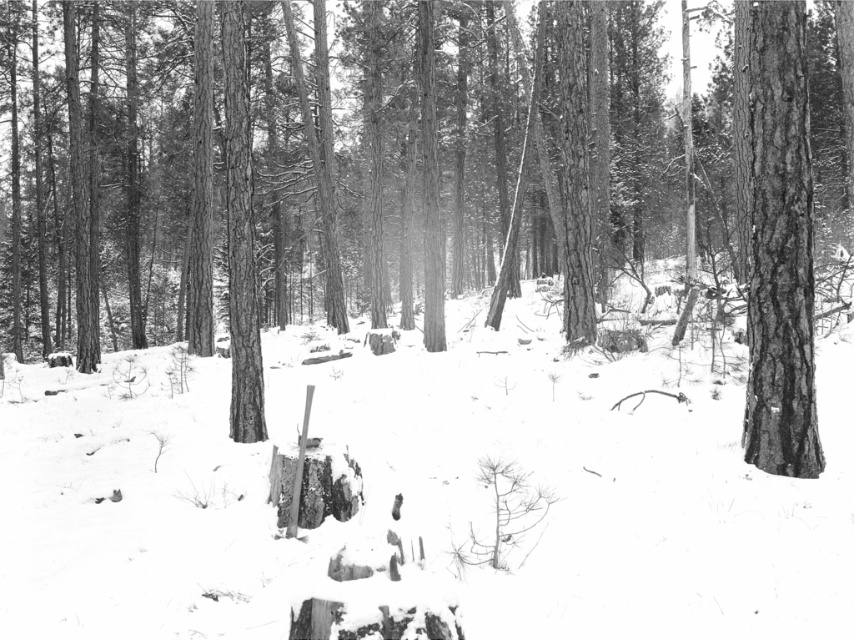
Who is taller, rough bark tree at center or white powdery snow at center?

rough bark tree at center is taller.

Does rough bark tree at center appear on the right side of white powdery snow at center?

In fact, rough bark tree at center is to the left of white powdery snow at center.

Is point (197, 120) positioned before point (383, 456)?

No, (197, 120) is further to viewer.

Where is `rough bark tree at center`? rough bark tree at center is located at coordinates (413, 182).

Can you confirm if white powdery snow at center is thinner than smooth bark tree at right?

Incorrect, white powdery snow at center's width is not less than smooth bark tree at right's.

Between white powdery snow at center and smooth bark tree at right, which one is positioned lower?

white powdery snow at center is below.

The width and height of the screenshot is (854, 640). What do you see at coordinates (601, 486) in the screenshot?
I see `white powdery snow at center` at bounding box center [601, 486].

Find the location of a particular element. The height and width of the screenshot is (640, 854). white powdery snow at center is located at coordinates (601, 486).

Between point (461, 65) and point (769, 51), which one is positioned behind?

Point (461, 65)

Can you confirm if rough bark tree at center is smaller than smooth bark tree at right?

Incorrect, rough bark tree at center is not smaller in size than smooth bark tree at right.

Does point (527, 220) come farther from viewer compared to point (782, 67)?

Yes, point (527, 220) is behind point (782, 67).

Identify the location of rough bark tree at center. The height and width of the screenshot is (640, 854). (413, 182).